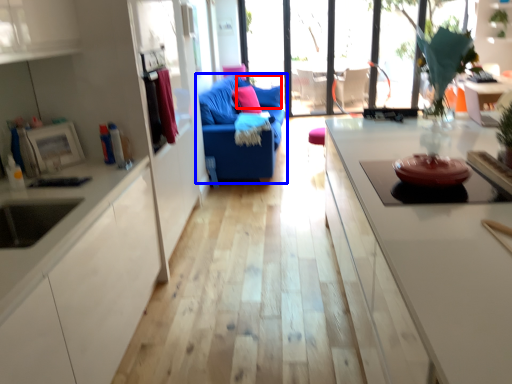
Question: Which point is further to the camera, pillow (highlighted by a red box) or studio couch (highlighted by a blue box)?

Choices:
 (A) pillow
 (B) studio couch

Answer: (A)